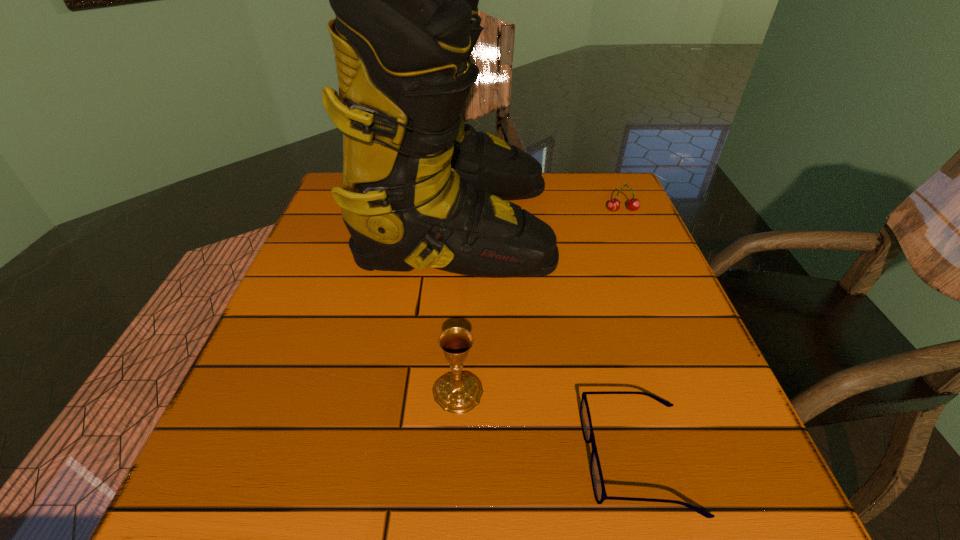
The width and height of the screenshot is (960, 540). Find the location of `free spot at the far edge of the desktop`. free spot at the far edge of the desktop is located at coordinates (548, 185).

Find the location of a particular element. Image resolution: width=960 pixels, height=540 pixels. free region at the left edge is located at coordinates (348, 259).

Identify the location of vacant region at the right edge of the desktop. (606, 251).

The image size is (960, 540). Find the location of `blank space at the near left corner`. blank space at the near left corner is located at coordinates (229, 493).

At what (x,y) coordinates should I click in order to perform the action: click on vacant position at the far right corner of the desktop. Please return your answer as a coordinate pair (x, y). The width and height of the screenshot is (960, 540). Looking at the image, I should click on (594, 180).

In the image, there is a desktop. Where is `free space at the near right corner`? This screenshot has width=960, height=540. free space at the near right corner is located at coordinates (745, 521).

I want to click on free area in between the cherry and the second tallest object, so click(x=540, y=301).

Where is `vacant space in between the ski boots and the rightmost object`? The image size is (960, 540). vacant space in between the ski boots and the rightmost object is located at coordinates (540, 217).

Image resolution: width=960 pixels, height=540 pixels. Identify the location of free space that is in between the ski boots and the rightmost object. (540, 217).

Identify the location of vacant space that's between the ski boots and the spectacles. (x=547, y=341).